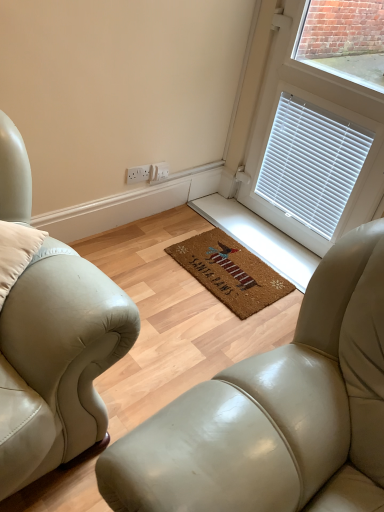
Question: Does leather studio couch at center have a greater width compared to white blinds at upper right?

Choices:
 (A) no
 (B) yes

Answer: (B)

Question: Is leather studio couch at center facing towards white blinds at upper right?

Choices:
 (A) no
 (B) yes

Answer: (A)

Question: Is leather studio couch at center placed right next to white blinds at upper right?

Choices:
 (A) yes
 (B) no

Answer: (B)

Question: From a real-world perspective, is leather studio couch at center on top of white blinds at upper right?

Choices:
 (A) no
 (B) yes

Answer: (A)

Question: Considering the relative sizes of leather studio couch at center and white blinds at upper right in the image provided, is leather studio couch at center taller than white blinds at upper right?

Choices:
 (A) no
 (B) yes

Answer: (A)

Question: Considering their positions, is white plastic electrical outlet at center located in front of or behind leather studio couch at center?

Choices:
 (A) behind
 (B) front

Answer: (A)

Question: From the image's perspective, is white plastic electrical outlet at center located above or below leather studio couch at center?

Choices:
 (A) above
 (B) below

Answer: (A)

Question: Is white plastic electrical outlet at center taller or shorter than leather studio couch at center?

Choices:
 (A) tall
 (B) short

Answer: (A)

Question: From a real-world perspective, is white plastic electrical outlet at center positioned above or below leather studio couch at center?

Choices:
 (A) above
 (B) below

Answer: (A)

Question: Is leather studio couch at center spatially inside brown coir mat at center, or outside of it?

Choices:
 (A) outside
 (B) inside

Answer: (A)

Question: Considering their positions, is leather studio couch at center located in front of or behind brown coir mat at center?

Choices:
 (A) behind
 (B) front

Answer: (B)

Question: Is leather studio couch at center bigger or smaller than brown coir mat at center?

Choices:
 (A) big
 (B) small

Answer: (A)

Question: From the image's perspective, is leather studio couch at center above or below brown coir mat at center?

Choices:
 (A) below
 (B) above

Answer: (A)

Question: From their relative heights in the image, would you say leather studio couch at center is taller or shorter than white blinds at upper right?

Choices:
 (A) tall
 (B) short

Answer: (B)

Question: From the image's perspective, relative to white blinds at upper right, is leather studio couch at center above or below?

Choices:
 (A) below
 (B) above

Answer: (A)